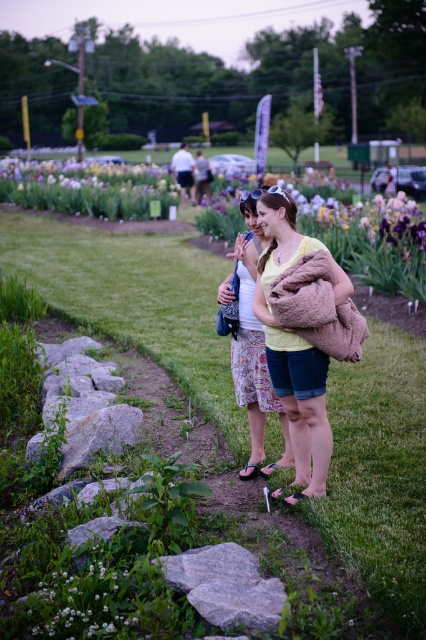
Question: Which point is farther to the camera?

Choices:
 (A) (60, 164)
 (B) (109, 189)

Answer: (A)

Question: Is yellow cotton shirt at center above white matte flower at lower left?

Choices:
 (A) no
 (B) yes

Answer: (B)

Question: Considering the real-world distances, which object is closest to the white matte flower at lower left?

Choices:
 (A) yellow cotton shirt at center
 (B) purple irises at upper left
 (C) light brown fuzzy coat at center

Answer: (C)

Question: Can you confirm if light brown fuzzy coat at center is positioned below white matte flower at lower left?

Choices:
 (A) yes
 (B) no

Answer: (B)

Question: Which of the following is the closest to the observer?

Choices:
 (A) purple irises at upper left
 (B) yellow cotton shirt at center
 (C) purple matte flowers at upper center

Answer: (B)

Question: Does purple matte flowers at upper center appear on the right side of purple irises at upper left?

Choices:
 (A) yes
 (B) no

Answer: (A)